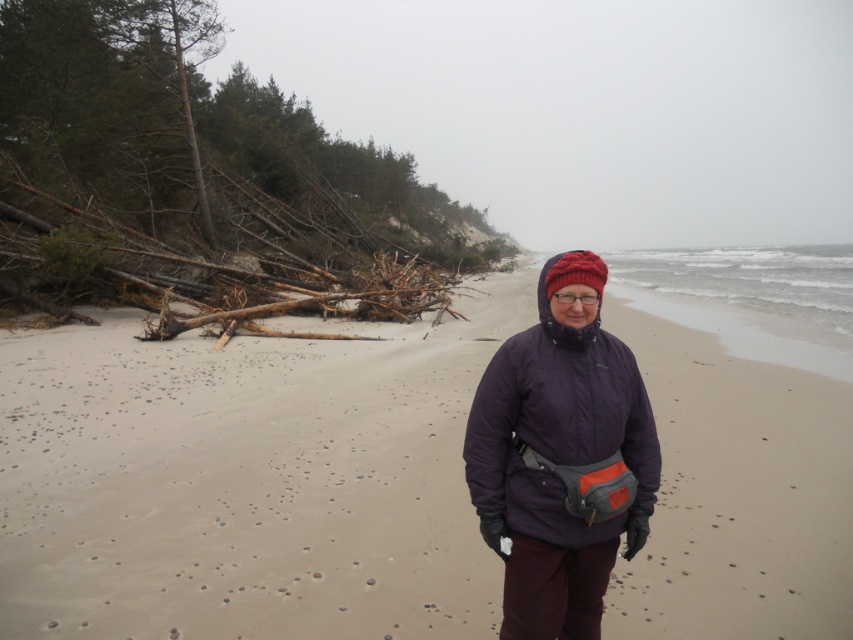
Question: Is purple synthetic jacket at center positioned behind red knitted hat at center?

Choices:
 (A) no
 (B) yes

Answer: (B)

Question: Which object appears closest to the camera in this image?

Choices:
 (A) red knitted hat at center
 (B) purple synthetic jacket at center
 (C) smooth sand at center

Answer: (A)

Question: Which of the following is the farthest from the observer?

Choices:
 (A) (558, 276)
 (B) (656, 468)

Answer: (B)

Question: Which object is the closest to the red knitted hat at center?

Choices:
 (A) smooth sand at center
 (B) purple synthetic jacket at center

Answer: (B)

Question: Is smooth sand at center positioned in front of purple synthetic jacket at center?

Choices:
 (A) no
 (B) yes

Answer: (A)

Question: Can you confirm if purple synthetic jacket at center is positioned to the right of red knitted hat at center?

Choices:
 (A) no
 (B) yes

Answer: (A)